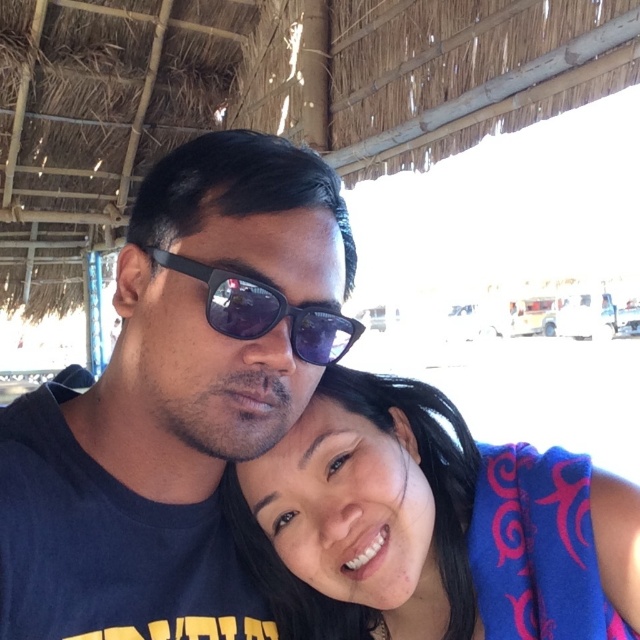
You are a photographer trying to capture a closeup of the sunglasses worn by the two people in the image. Which pair of sunglasses, the matte black sunglasses at upper center or the black matte sunglasses at center, would appear larger in your photo?

The matte black sunglasses at upper center would appear larger in the photo since they are bigger than the black matte sunglasses at center.

You are a photographer trying to capture the perfect shot of the matte black sunglasses at upper center and the blue fabric towel at lower right. Which object should you focus on first if you want to ensure both are in sharp focus, considering their sizes?

The matte black sunglasses at upper center is much taller than the blue fabric towel at lower right, so focusing on the larger object first would help ensure both are in sharp focus.